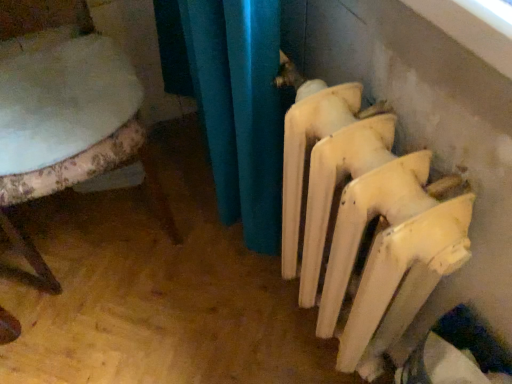
Find the location of a particular element. This screenshot has height=384, width=512. white fabric chair at left is located at coordinates (104, 170).

Image resolution: width=512 pixels, height=384 pixels. What do you see at coordinates (104, 170) in the screenshot?
I see `white fabric chair at left` at bounding box center [104, 170].

This screenshot has width=512, height=384. Find the location of `white matte radiator at lower right`. white matte radiator at lower right is located at coordinates (362, 220).

Measure the distance between white matte radiator at lower right and camera.

The distance of white matte radiator at lower right from camera is 19.29 inches.

What do you see at coordinates (362, 220) in the screenshot?
I see `white matte radiator at lower right` at bounding box center [362, 220].

Where is `white fabric chair at left`? This screenshot has width=512, height=384. white fabric chair at left is located at coordinates [104, 170].

Which is more to the right, white fabric chair at left or white matte radiator at lower right?

Positioned to the right is white matte radiator at lower right.

Is white fabric chair at left positioned behind white matte radiator at lower right?

Yes, white fabric chair at left is further from the viewer.

Does point (66, 176) come closer to viewer compared to point (468, 246)?

No, (66, 176) is further to viewer.

From the image's perspective, relative to white matte radiator at lower right, is white fabric chair at left above or below?

Clearly, from the image's perspective, white fabric chair at left is above white matte radiator at lower right.

From a real-world perspective, which object rests below the other?

white fabric chair at left is physically lower.

Which of these two, white fabric chair at left or white matte radiator at lower right, is wider?

Wider between the two is white fabric chair at left.

Which of these two, white fabric chair at left or white matte radiator at lower right, stands shorter?

With less height is white matte radiator at lower right.

Who is bigger, white fabric chair at left or white matte radiator at lower right?

white fabric chair at left is bigger.

Do you think white fabric chair at left is within white matte radiator at lower right, or outside of it?

white fabric chair at left exists outside the volume of white matte radiator at lower right.

Are white fabric chair at left and white matte radiator at lower right beside each other?

There is a gap between white fabric chair at left and white matte radiator at lower right.

Is white matte radiator at lower right at the back of white fabric chair at left?

white fabric chair at left does not have its back to white matte radiator at lower right.

The image size is (512, 384). What are the coordinates of `radiator in front of the white fabric chair at left` in the screenshot? It's located at (362, 220).

Between white matte radiator at lower right and white fabric chair at left, which one appears on the left side from the viewer's perspective?

white fabric chair at left is more to the left.

Is white matte radiator at lower right behind white fabric chair at left?

That is False.

Does point (309, 236) come in front of point (40, 267)?

Yes.

From the image's perspective, which is below, white matte radiator at lower right or white fabric chair at left?

white matte radiator at lower right appears lower in the image.

From a real-world perspective, is white matte radiator at lower right positioned under white fabric chair at left based on gravity?

No, from a real-world perspective, white matte radiator at lower right is not below white fabric chair at left.

Which of these two, white matte radiator at lower right or white fabric chair at left, is thinner?

white matte radiator at lower right is thinner.

Is white matte radiator at lower right shorter than white fabric chair at left?

Indeed, white matte radiator at lower right has a lesser height compared to white fabric chair at left.

Is white matte radiator at lower right bigger than white fabric chair at left?

No.

Do you think white matte radiator at lower right is within white fabric chair at left, or outside of it?

white matte radiator at lower right exists outside the volume of white fabric chair at left.

Would you consider white matte radiator at lower right to be distant from white fabric chair at left?

Actually, white matte radiator at lower right and white fabric chair at left are a little close together.

Is white matte radiator at lower right turned away from white fabric chair at left?

No.

How different are the orientations of white matte radiator at lower right and white fabric chair at left in degrees?

The angle between the facing direction of white matte radiator at lower right and the facing direction of white fabric chair at left is 89.1 degrees.

Where is `chair that appears behind the white matte radiator at lower right`? chair that appears behind the white matte radiator at lower right is located at coordinates (104, 170).

You are a GUI agent. You are given a task and a screenshot of the screen. Output one action in this format:
    pyautogui.click(x=<x>, y=<y>)
    Task: Click on the radiator on the right of white fabric chair at left
    This screenshot has width=512, height=384.
    Given the screenshot: What is the action you would take?
    pyautogui.click(x=362, y=220)

I want to click on chair that is on the left side of white matte radiator at lower right, so click(104, 170).